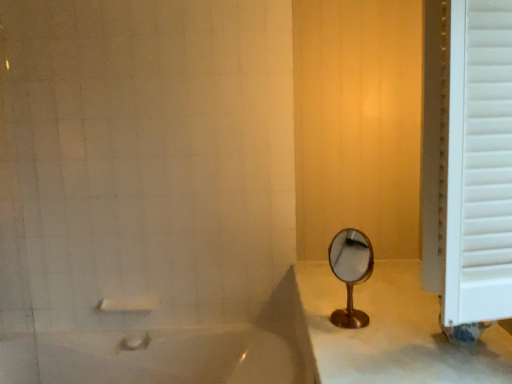
Question: Does point (455, 264) appear closer or farther from the camera than point (251, 347)?

Choices:
 (A) closer
 (B) farther

Answer: (A)

Question: In terms of width, does white wooden window frame at right look wider or thinner when compared to white glossy bathtub at lower left?

Choices:
 (A) thin
 (B) wide

Answer: (A)

Question: Based on their relative distances, which object is farther from the gold metallic mirror at center?

Choices:
 (A) white glossy bathtub at lower left
 (B) white matte towel bar at lower left
 (C) white wooden window frame at right

Answer: (B)

Question: Which object is the closest to the white matte towel bar at lower left?

Choices:
 (A) gold metallic mirror at center
 (B) white glossy bathtub at lower left
 (C) white wooden window frame at right

Answer: (B)